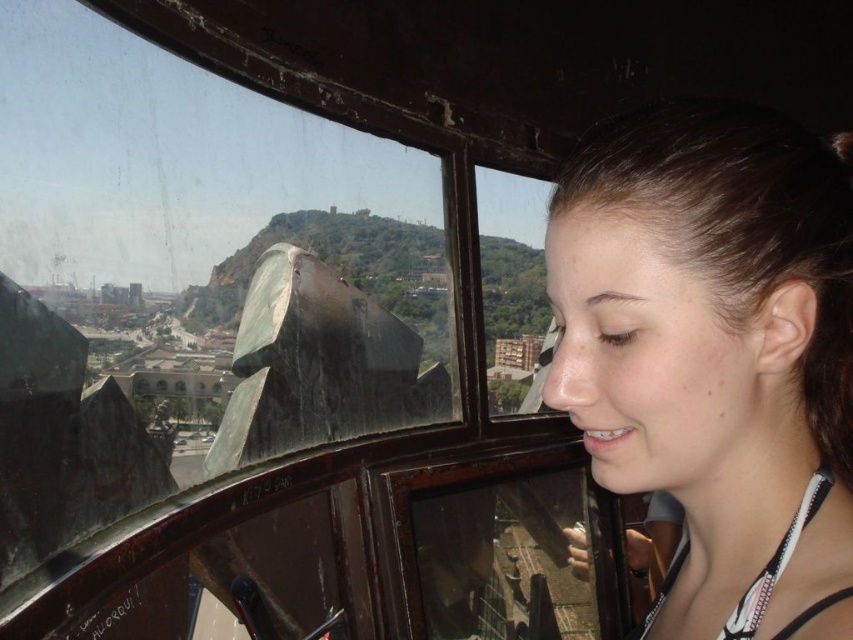
Question: Is transparent glass window at center positioned before smooth brown hair at right?

Choices:
 (A) no
 (B) yes

Answer: (A)

Question: Is transparent glass window at center behind smooth brown hair at right?

Choices:
 (A) yes
 (B) no

Answer: (A)

Question: Is transparent glass window at center to the left of smooth brown hair at right from the viewer's perspective?

Choices:
 (A) no
 (B) yes

Answer: (B)

Question: Which point is farther to the camera?

Choices:
 (A) (97, 476)
 (B) (799, 296)

Answer: (A)

Question: Which of the following is the closest to the observer?

Choices:
 (A) click(752, 520)
 (B) click(90, 458)

Answer: (A)